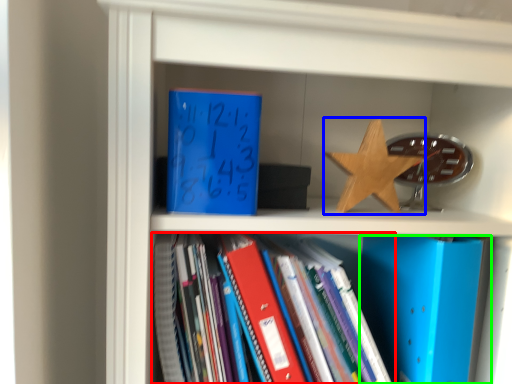
Question: Based on their relative distances, which object is farther from book (highlighted by a red box)? Choose from star (highlighted by a blue box) and paperback book (highlighted by a green box).

Choices:
 (A) star
 (B) paperback book

Answer: (A)